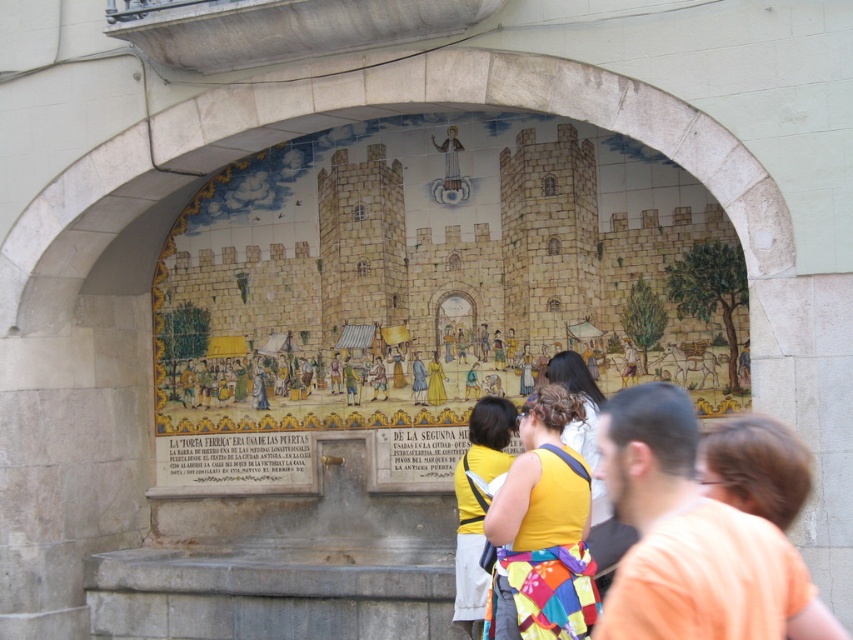
You are an artist trying to replicate the mural. You notice two elements in the scene that need to be scaled proportionally. The orange cotton shirt at lower right and the yellow fabric at center. Which one should you make bigger in your painting?

The orange cotton shirt at lower right should be made bigger in the painting since it has a larger size compared to the yellow fabric at center according to the description.